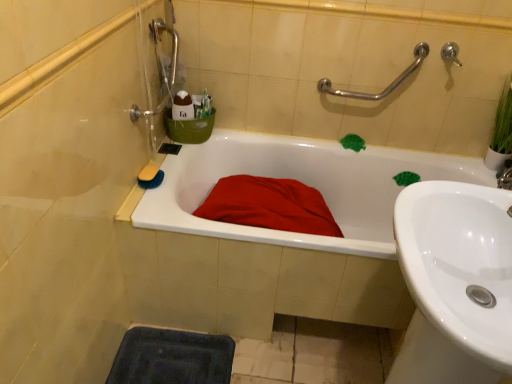
I want to click on free spot above dark blue rubber bath mat at lower left (from a real-world perspective), so click(173, 358).